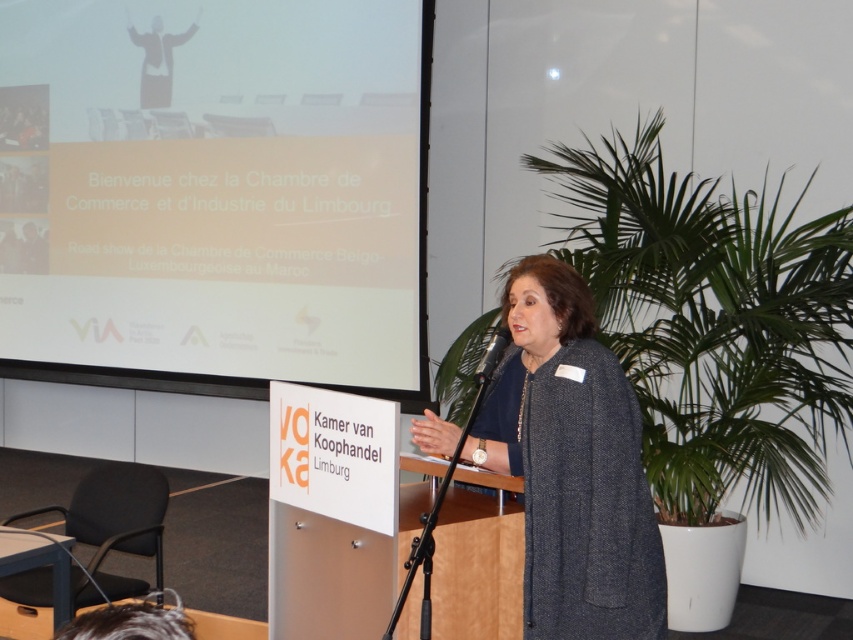
Question: Which of these objects is positioned closest to the white matte projection screen at upper left?

Choices:
 (A) matte black suit at upper left
 (B) dark gray woolen coat at center

Answer: (A)

Question: Which of the following is the farthest from the observer?

Choices:
 (A) black plastic microphone at center
 (B) white matte projection screen at upper left

Answer: (B)

Question: Is white matte projection screen at upper left thinner than dark gray woolen coat at center?

Choices:
 (A) yes
 (B) no

Answer: (B)

Question: From the image, what is the correct spatial relationship of matte black suit at upper left in relation to black plastic microphone at center?

Choices:
 (A) left
 (B) right

Answer: (A)

Question: Can you confirm if white matte projection screen at upper left is positioned to the right of matte black suit at upper left?

Choices:
 (A) no
 (B) yes

Answer: (B)

Question: Among these points, which one is farthest from the camera?

Choices:
 (A) (604, 504)
 (B) (171, 61)
 (C) (38, 204)
 (D) (485, 364)

Answer: (C)